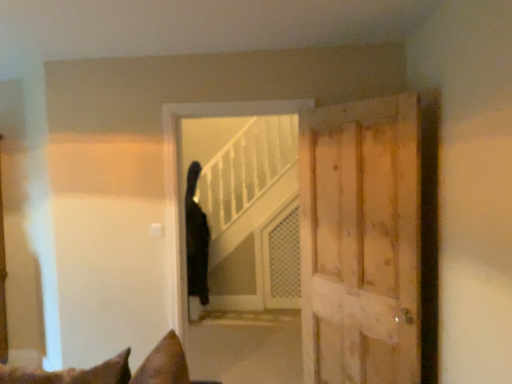
Question: Is white mesh screen door at center taller or shorter than light brown wooden door at right?

Choices:
 (A) tall
 (B) short

Answer: (B)

Question: Is white mesh screen door at center bigger or smaller than light brown wooden door at right?

Choices:
 (A) big
 (B) small

Answer: (B)

Question: Which object is the farthest from the black matte elevator at center?

Choices:
 (A) light brown wooden door at right
 (B) black fur cat at center
 (C) white mesh screen door at center

Answer: (A)

Question: Estimate the real-world distances between objects in this image. Which object is farther from the white mesh screen door at center?

Choices:
 (A) black fur cat at center
 (B) light brown wooden door at right
 (C) black matte elevator at center

Answer: (B)